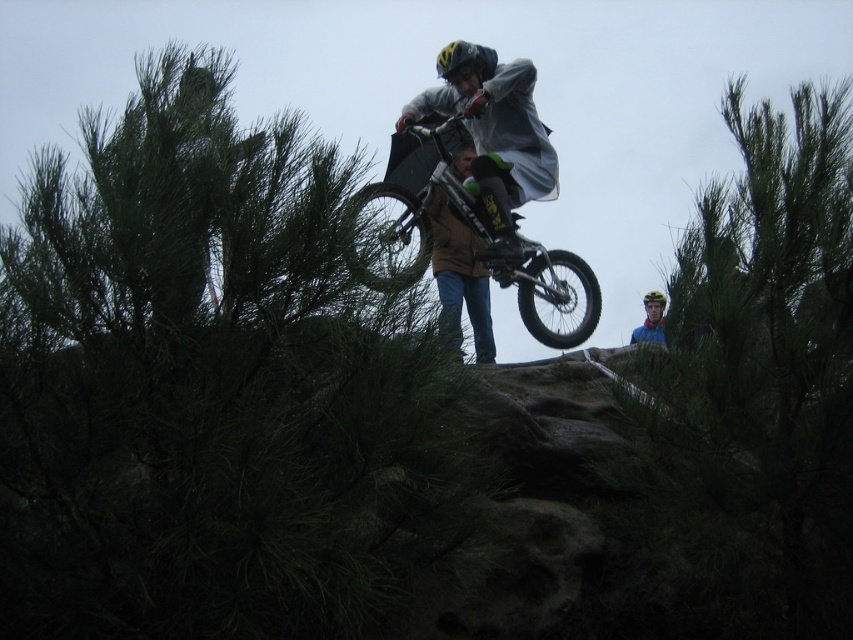
In the scene shown: You are a drone operator trying to capture the cyclist midair. You notice a green leafy tree at upper left. Where is the point with coordinates point [212,388] located?

The point with coordinates point [212,388] is located on the green leafy tree at upper left.